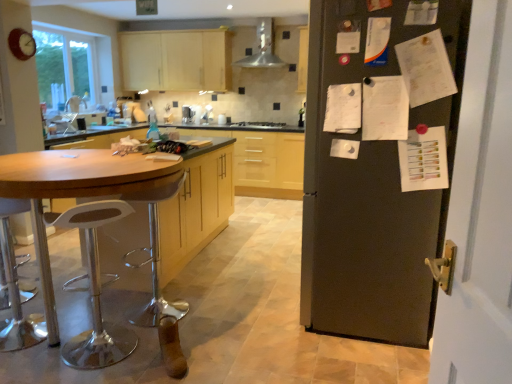
Find the location of a particular element. This screenshot has width=512, height=384. free spot to the right of metallic silver bar stool at left, placed as the 1th bar stool when sorted from back to front is located at coordinates (211, 311).